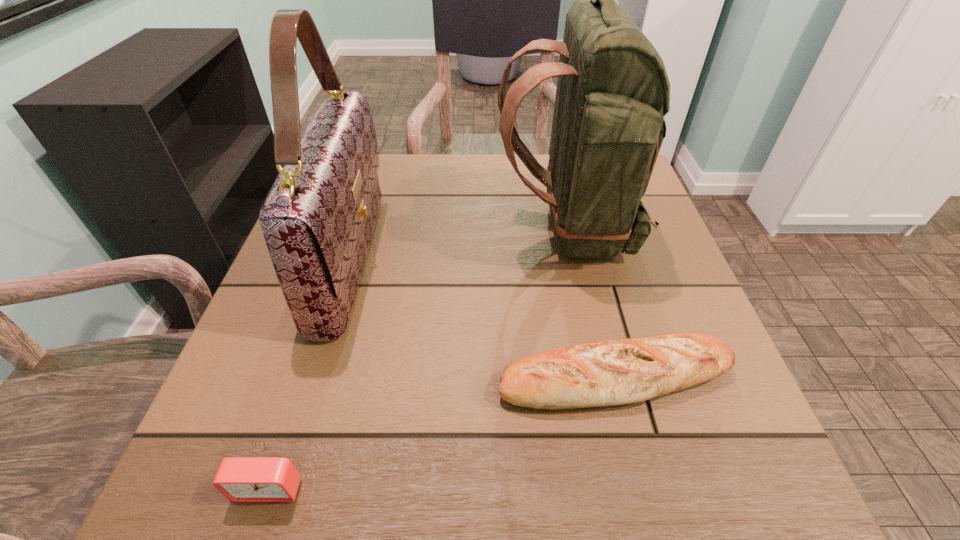
Find the location of a particular element. This screenshot has width=960, height=540. backpack situated at the far edge is located at coordinates (613, 91).

You are a GUI agent. You are given a task and a screenshot of the screen. Output one action in this format:
    pyautogui.click(x=<x>, y=<y>)
    Task: Click on the object that is positioned at the near edge
    
    Given the screenshot: What is the action you would take?
    pyautogui.click(x=240, y=479)

Identify the location of handbag that is at the left edge. (318, 218).

The image size is (960, 540). In order to click on alarm clock that is at the left edge in this screenshot , I will do `click(240, 479)`.

The image size is (960, 540). In order to click on backpack at the right edge in this screenshot , I will do `click(613, 91)`.

The width and height of the screenshot is (960, 540). Find the location of `baguet that is at the right edge`. baguet that is at the right edge is located at coordinates (611, 372).

Identify the location of object that is at the far left corner. (318, 218).

Locate an element on the screen. This screenshot has height=540, width=960. object that is at the near left corner is located at coordinates (240, 479).

You are a GUI agent. You are given a task and a screenshot of the screen. Output one action in this format:
    pyautogui.click(x=<x>, y=<y>)
    Task: Click on the object situated at the far right corner
    Image resolution: width=960 pixels, height=540 pixels.
    Given the screenshot: What is the action you would take?
    pyautogui.click(x=613, y=91)

Identify the location of free space at the far edge of the desktop. (447, 197).